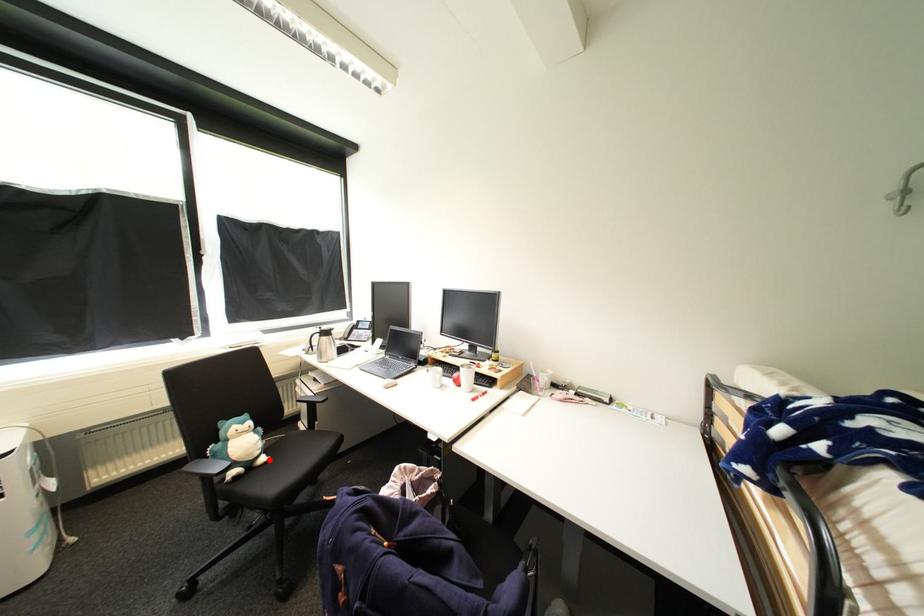
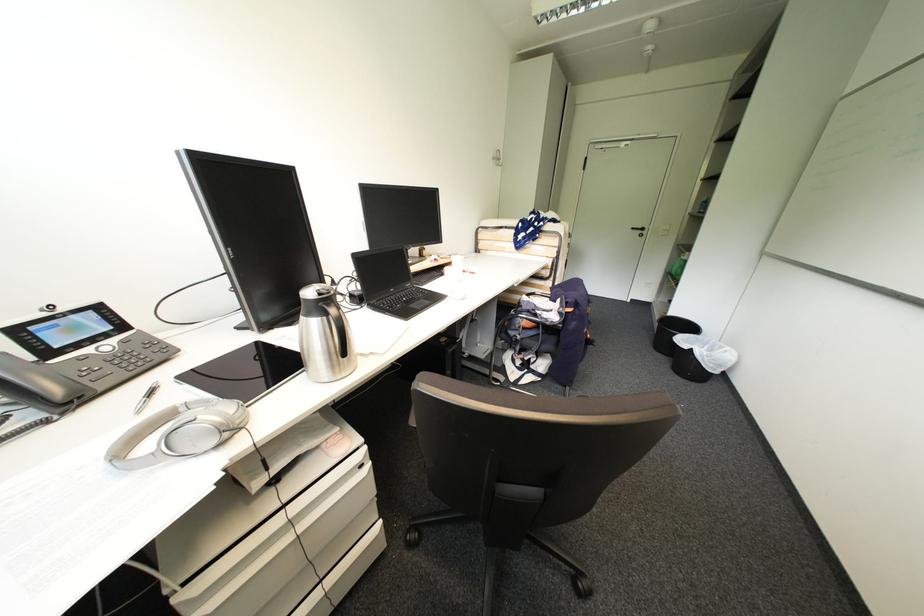
Question: I am providing you with two images of the same scene from different viewpoints. A red point is marked on the first image. Is the red point's position out of view in image 2?

Choices:
 (A) Yes
 (B) No

Answer: (A)